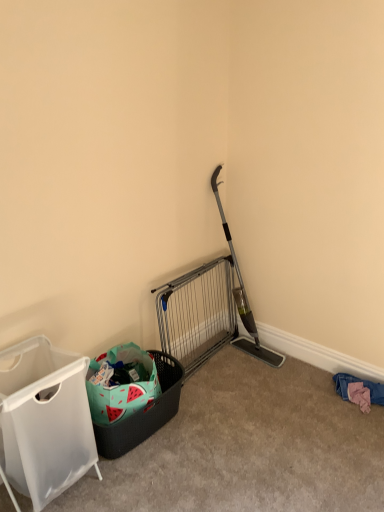
Question: Considering the relative positions of silver metallic gate at center and watermelon-patterned plastic basket at lower left in the image provided, is silver metallic gate at center to the left or to the right of watermelon-patterned plastic basket at lower left?

Choices:
 (A) left
 (B) right

Answer: (B)

Question: Is silver metallic gate at center inside the boundaries of watermelon-patterned plastic basket at lower left, or outside?

Choices:
 (A) inside
 (B) outside

Answer: (B)

Question: Estimate the real-world distances between objects in this image. Which object is closer to the silver metallic gate at center?

Choices:
 (A) pink fabric at lower right
 (B) watermelon-patterned plastic basket at lower left
 (C) white fabric laundry basket at left

Answer: (B)

Question: Which is nearer to the white fabric laundry basket at left?

Choices:
 (A) pink fabric at lower right
 (B) silver metallic gate at center
 (C) watermelon-patterned plastic basket at lower left

Answer: (C)